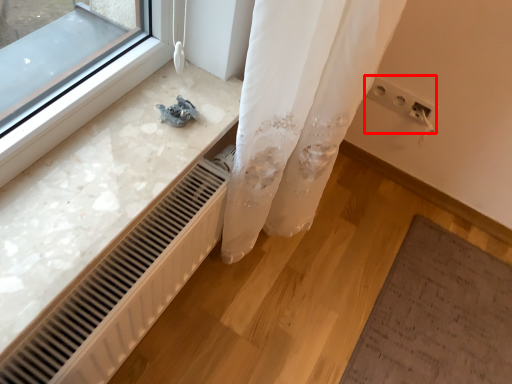
Question: From the image's perspective, what is the correct spatial positioning of electric outlet (annotated by the red box) in reference to radiator?

Choices:
 (A) above
 (B) below

Answer: (A)